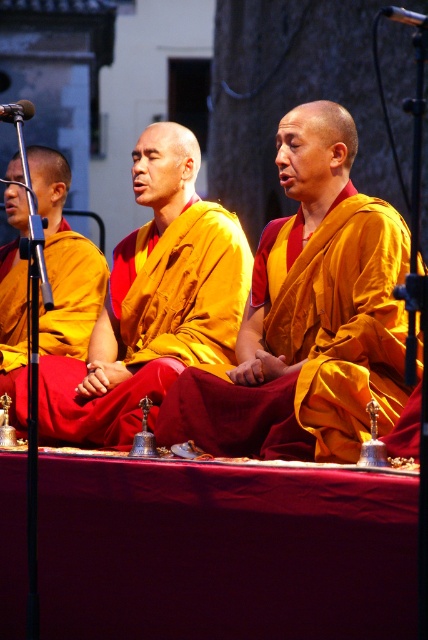
Does burgundy fabric tablecloth at center appear on the left side of matte gold robe at left?

Incorrect, burgundy fabric tablecloth at center is not on the left side of matte gold robe at left.

Does burgundy fabric tablecloth at center have a lesser width compared to matte gold robe at left?

Incorrect, burgundy fabric tablecloth at center's width is not less than matte gold robe at left's.

Describe the element at coordinates (223, 552) in the screenshot. I see `burgundy fabric tablecloth at center` at that location.

Where is `burgundy fabric tablecloth at center`? The image size is (428, 640). burgundy fabric tablecloth at center is located at coordinates (223, 552).

Does matte gold robe at left appear on the right side of metallic microphone at left?

Indeed, matte gold robe at left is positioned on the right side of metallic microphone at left.

Does matte gold robe at left have a greater height compared to metallic microphone at left?

Correct, matte gold robe at left is much taller as metallic microphone at left.

Locate an element on the screen. Image resolution: width=428 pixels, height=640 pixels. matte gold robe at left is located at coordinates (65, 262).

Who is more forward, (x=415, y=20) or (x=5, y=116)?

Point (x=415, y=20) is in front.

Between metallic silver microphone at upper right and metallic microphone at left, which one appears on the left side from the viewer's perspective?

Positioned to the left is metallic microphone at left.

Who is more forward, (413, 22) or (15, 120)?

Point (413, 22)

I want to click on metallic silver microphone at upper right, so 406,17.